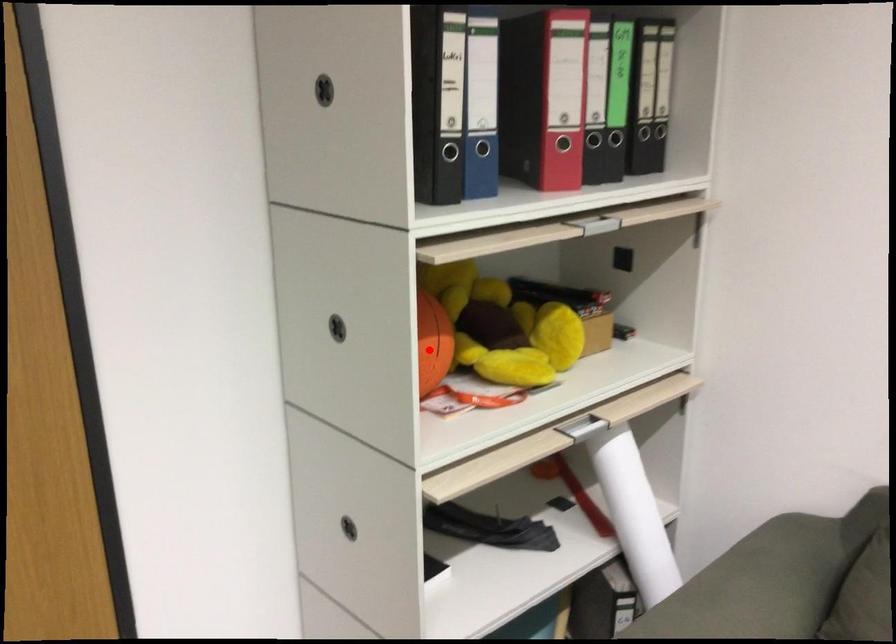
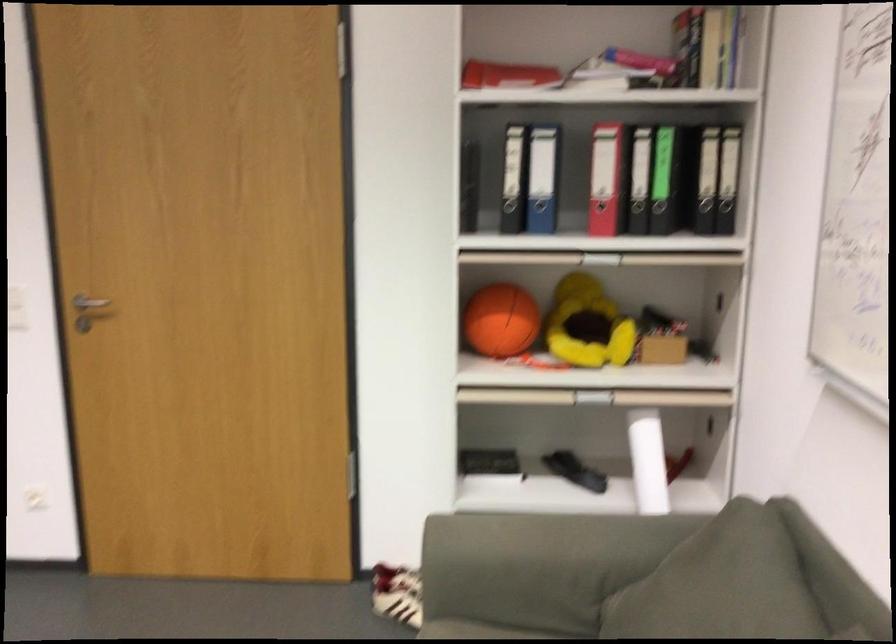
Question: I am providing you with two images of the same scene from different viewpoints. Given a red point in image1, look at the same physical point in image2. Is it:

Choices:
 (A) Closer to the viewpoint
 (B) Farther from the viewpoint

Answer: (B)